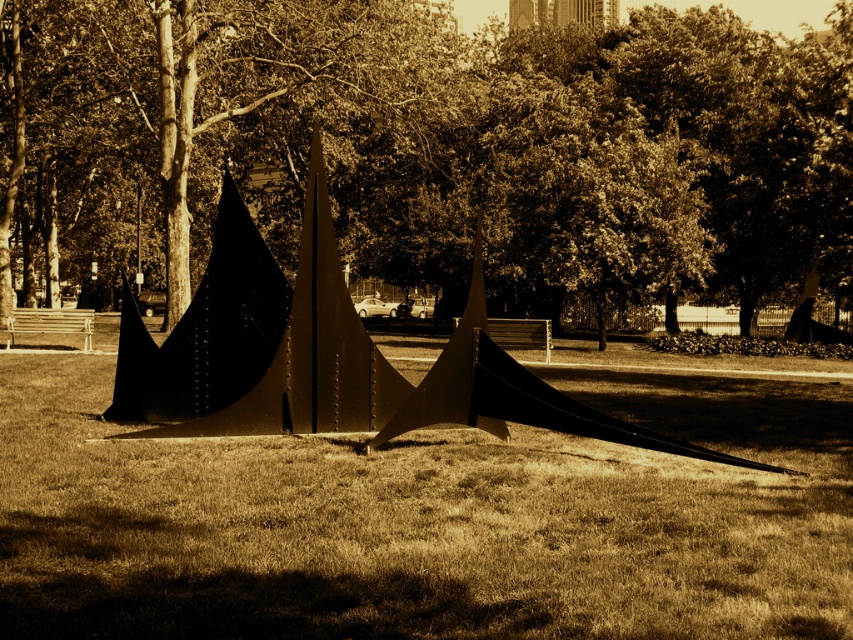
Question: Which object appears farthest from the camera in this image?

Choices:
 (A) metallic gold pyramid at center
 (B) brown textured tree at upper center

Answer: (B)

Question: Can you confirm if brown matte grass at center is positioned below metallic gold pyramid at center?

Choices:
 (A) no
 (B) yes

Answer: (B)

Question: In this image, where is brown textured tree at upper center located relative to brown matte grass at center?

Choices:
 (A) below
 (B) above

Answer: (B)

Question: Which of the following is the farthest from the observer?

Choices:
 (A) brown matte grass at center
 (B) brown textured tree at upper center

Answer: (B)

Question: Among these points, which one is farthest from the camera?

Choices:
 (A) (817, 120)
 (B) (312, 125)

Answer: (A)

Question: Can you confirm if brown textured tree at upper center is positioned to the left of metallic gold pyramid at center?

Choices:
 (A) yes
 (B) no

Answer: (A)